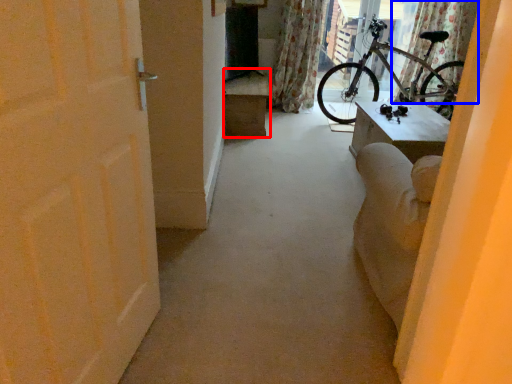
Question: Among these objects, which one is nearest to the camera, furniture (highlighted by a red box) or curtain (highlighted by a blue box)?

Choices:
 (A) furniture
 (B) curtain

Answer: (A)